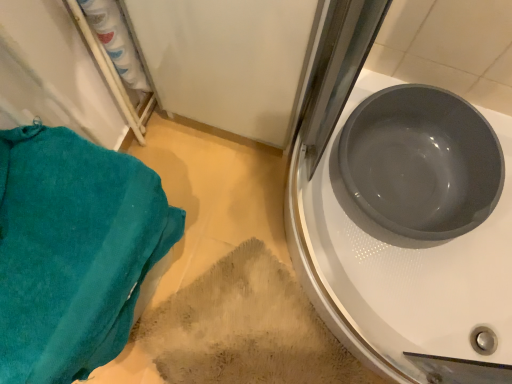
Locate an element on the screen. free location above teal terry cloth towel at lower left (from a real-world perspective) is located at coordinates (57, 246).